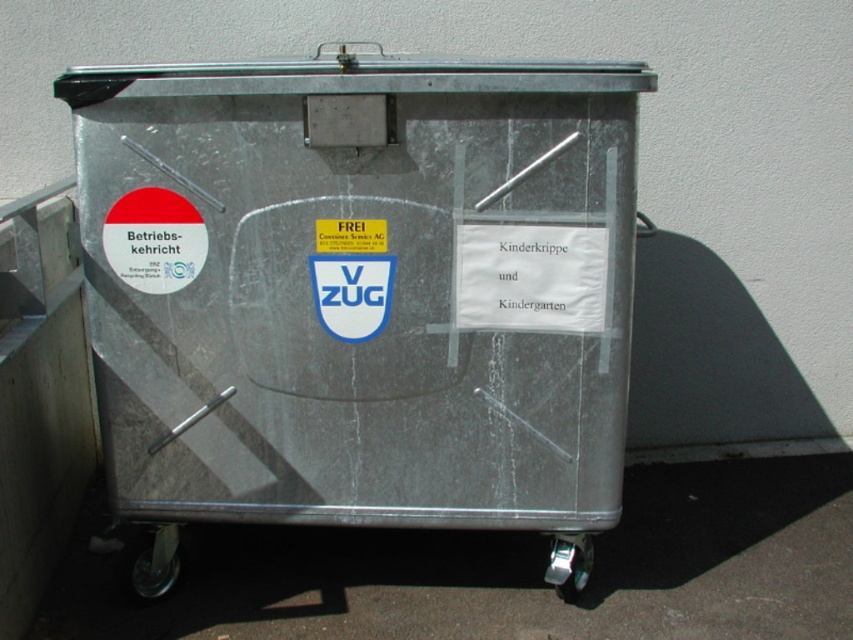
Question: Which point appears farthest from the camera in this image?

Choices:
 (A) (195, 273)
 (B) (148, 572)
 (C) (479, 524)
 (D) (346, 300)

Answer: (B)

Question: Which object is closer to the camera taking this photo?

Choices:
 (A) metallic trash can at center
 (B) matte white sticker at left
 (C) metallic at lower left
 (D) black rubber wheel at lower right

Answer: (A)

Question: From the image, what is the correct spatial relationship of blue glossy shield at center in relation to black rubber wheel at lower right?

Choices:
 (A) above
 (B) below

Answer: (A)

Question: Is metallic trash can at center above metallic at lower left?

Choices:
 (A) yes
 (B) no

Answer: (A)

Question: Which object is positioned farthest from the black rubber wheel at lower right?

Choices:
 (A) metallic trash can at center
 (B) blue glossy shield at center
 (C) metallic at lower left
 (D) matte white sticker at left

Answer: (D)

Question: Can you confirm if metallic trash can at center is wider than black rubber wheel at lower right?

Choices:
 (A) yes
 (B) no

Answer: (A)